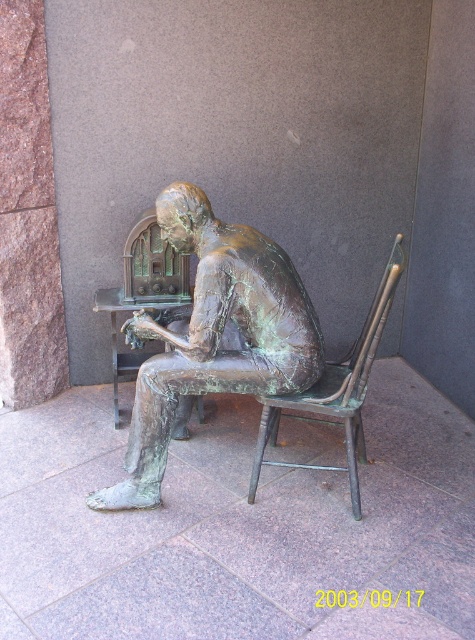
You are an art conservator assessing the space in front of the green patina bronze statue at center and the green patina wood chair at center. You need to determine if a protective barrier can be placed between them. The barrier requires at least 1 meter of space between the two objects. Can you confirm if there is enough space?

The green patina bronze statue at center is larger in size than the green patina wood chair at center, but the exact distance between them is not provided. Therefore, it is impossible to confirm if there is enough space for the protective barrier requiring 1 meter between them.